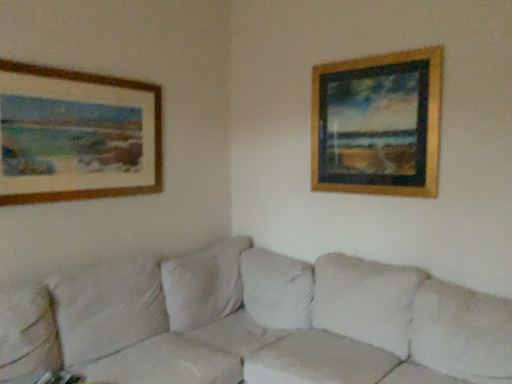
Locate an element on the screen. free point above gold wooden picture frame at upper right, the first picture frame positioned from the right (from a real-world perspective) is located at coordinates (384, 48).